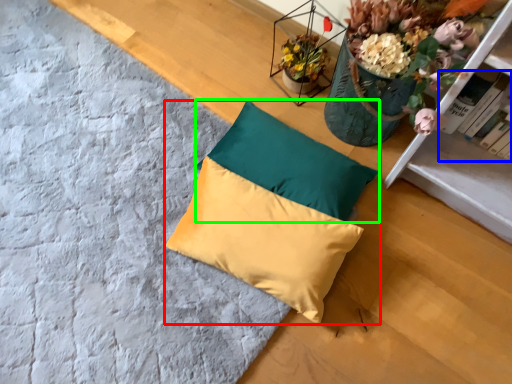
Question: Considering the real-world distances, which object is closest to pillow (highlighted by a red box)? book (highlighted by a blue box) or pillow (highlighted by a green box).

Choices:
 (A) book
 (B) pillow

Answer: (B)